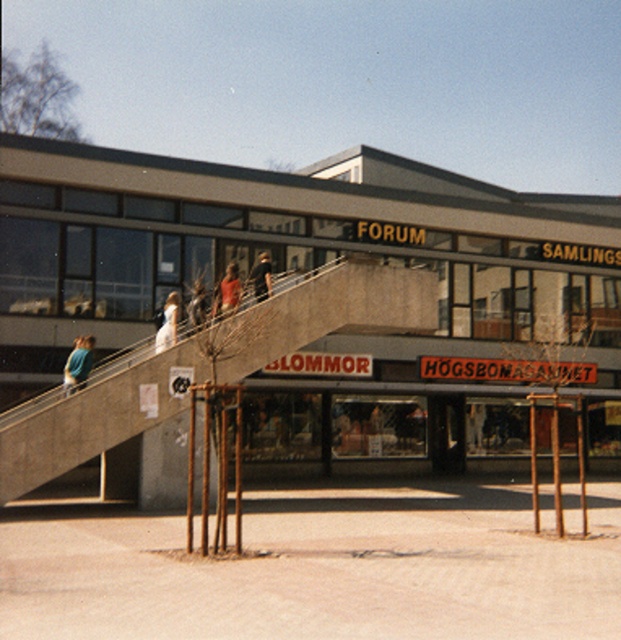
You are standing at the base of the staircase leading to the concrete building at center. If you want to reach the entrance quickly, how many steps would you need to climb?

The question cannot be answered with the provided information because the number of steps in the staircase is not specified in the scene description or object details.

You are a window shopper walking past the building and notice two items displayed in the storefront windows. The blue fabric shirt at lower left and the white dress at upper center. Which item is shorter in height?

The blue fabric shirt at lower left has a lesser height compared to the white dress at upper center, so the blue fabric shirt at lower left is shorter in height.

Looking at this image, you are a delivery person carrying a box that is as wide as the orange fabric shirt at upper center. You need to move the box up the concrete escalator at center. Based on the scene, will the escalator be wide enough to accommodate the box?

The concrete escalator at center is wider than the orange fabric shirt at upper center, so the escalator should be wide enough to accommodate the box since the box is as wide as the shirt.